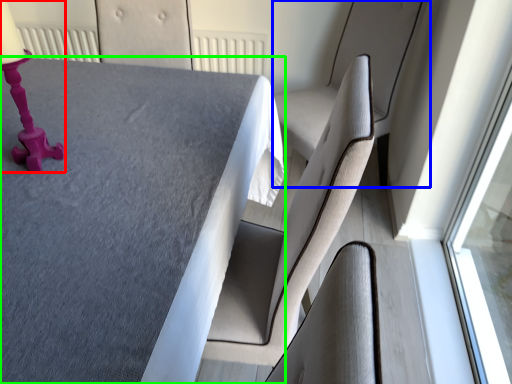
Question: Considering the real-world distances, which object is closest to table lamp (highlighted by a red box)? swivel chair (highlighted by a blue box) or table (highlighted by a green box).

Choices:
 (A) swivel chair
 (B) table

Answer: (B)